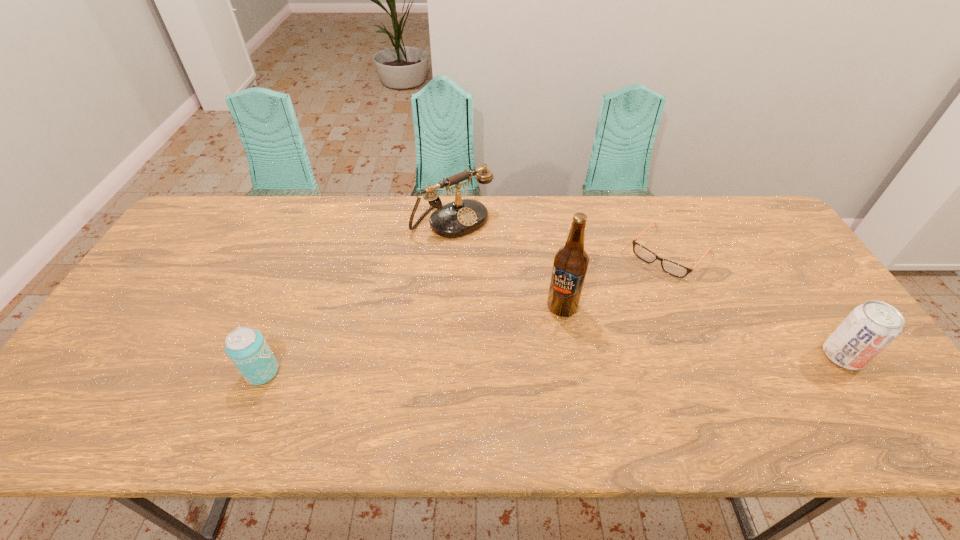
The width and height of the screenshot is (960, 540). Identify the location of telephone that is positioned at the far edge. (461, 217).

Identify the location of beer can positioned at the near edge. (246, 347).

The width and height of the screenshot is (960, 540). I want to click on soda can that is at the near edge, so click(870, 327).

Locate an element on the screen. The width and height of the screenshot is (960, 540). object that is positioned at the right edge is located at coordinates click(870, 327).

Identify the location of object located at the near right corner. The image size is (960, 540). (870, 327).

In the image, there is a desktop. Identify the location of vacant space at the far edge. (325, 214).

This screenshot has width=960, height=540. Find the location of `vacant space at the near edge of the desktop`. vacant space at the near edge of the desktop is located at coordinates (684, 387).

Find the location of a particular element. The image size is (960, 540). vacant space at the left edge of the desktop is located at coordinates (151, 316).

Identify the location of vacant space at the right edge. (806, 273).

You are a GUI agent. You are given a task and a screenshot of the screen. Output one action in this format:
    pyautogui.click(x=<x>, y=<y>)
    Task: Click on the vacant space at the near left corner of the desktop
    This screenshot has width=960, height=540.
    Given the screenshot: What is the action you would take?
    pyautogui.click(x=103, y=383)